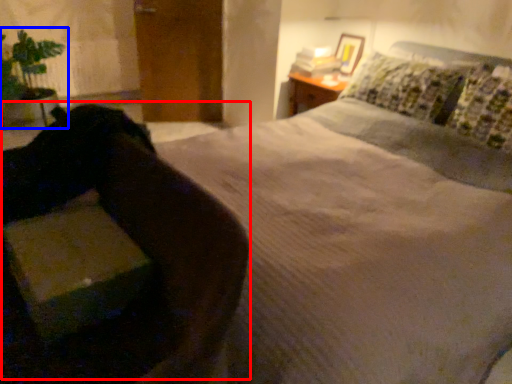
Question: Which of the following is the farthest to the observer, swivel chair (highlighted by a red box) or houseplant (highlighted by a blue box)?

Choices:
 (A) swivel chair
 (B) houseplant

Answer: (B)